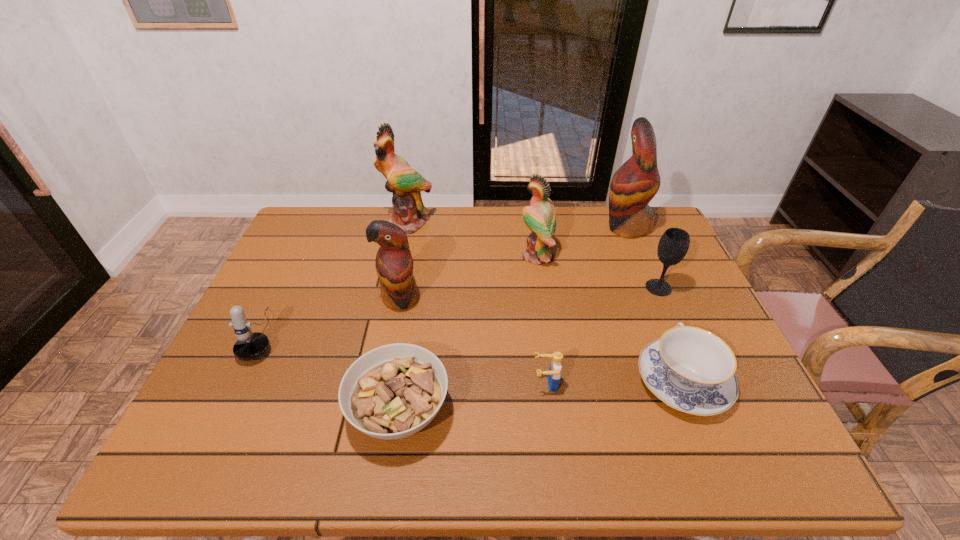
Identify which parrot is the third nearest to the microphone. Please provide its 2D coordinates. Your answer should be formatted as a tuple, i.e. [(x, y)], where the tuple contains the x and y coordinates of a point satisfying the conditions above.

[(540, 217)]

Find the location of a particular element. This screenshot has width=960, height=540. the second closest parrot to the leftmost object is located at coordinates (405, 183).

This screenshot has height=540, width=960. I want to click on vacant area in the image that satisfies the following two spatial constraints: 1. on the front-facing side of the smaller green parrot; 2. with the handle on the side of the chinaware, so pos(556,380).

This screenshot has height=540, width=960. Find the location of `free location that satisfies the following two spatial constraints: 1. on the front-facing side of the third parrot from left to right; 2. on the face of the nearer red parrot`. free location that satisfies the following two spatial constraints: 1. on the front-facing side of the third parrot from left to right; 2. on the face of the nearer red parrot is located at coordinates click(x=543, y=298).

Identify the location of vacant space that satisfies the following two spatial constraints: 1. on the face of the bigger red parrot; 2. on the right side of the wineglass. Image resolution: width=960 pixels, height=540 pixels. (652, 288).

Identify the location of free location that satisfies the following two spatial constraints: 1. on the face of the bigger red parrot; 2. on the front side of the white microphone. The width and height of the screenshot is (960, 540). (672, 335).